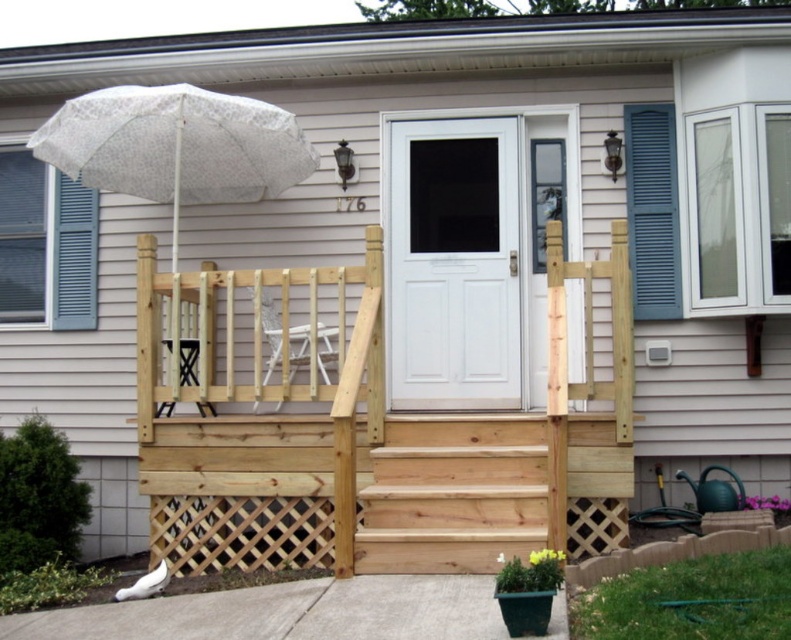
Who is lower down, white painted wood door at center or white lace umbrella at upper left?

white painted wood door at center is lower down.

How far apart are white painted wood door at center and white lace umbrella at upper left?

white painted wood door at center is 1.49 meters from white lace umbrella at upper left.

Where is `white painted wood door at center`? This screenshot has height=640, width=791. white painted wood door at center is located at coordinates (452, 262).

Is natural wood porch at center smaller than white painted wood door at center?

No.

Does point (509, 513) lie behind point (468, 352)?

No.

Is point (477, 442) more distant than point (513, 260)?

No, it is not.

Find the location of a particular element. The height and width of the screenshot is (640, 791). natural wood porch at center is located at coordinates (373, 435).

Between point (615, 513) and point (101, 106), which one is positioned in front?

Point (615, 513)

Measure the distance between natural wood porch at center and camera.

A distance of 16.36 feet exists between natural wood porch at center and camera.

What do you see at coordinates (373, 435) in the screenshot? The width and height of the screenshot is (791, 640). I see `natural wood porch at center` at bounding box center [373, 435].

Where is `natural wood porch at center`? The height and width of the screenshot is (640, 791). natural wood porch at center is located at coordinates (373, 435).